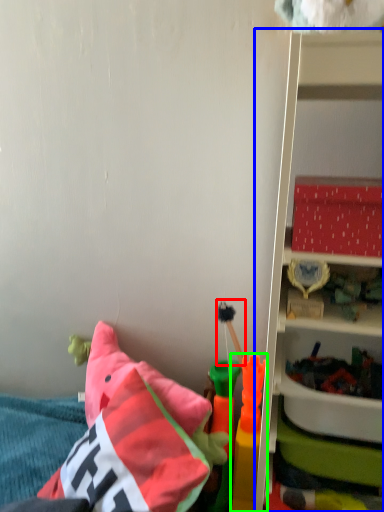
Question: Estimate the real-world distances between objects in this image. Which object is farther from toy (highlighted by a red box), shelf (highlighted by a blue box) or toy (highlighted by a green box)?

Choices:
 (A) shelf
 (B) toy

Answer: (A)